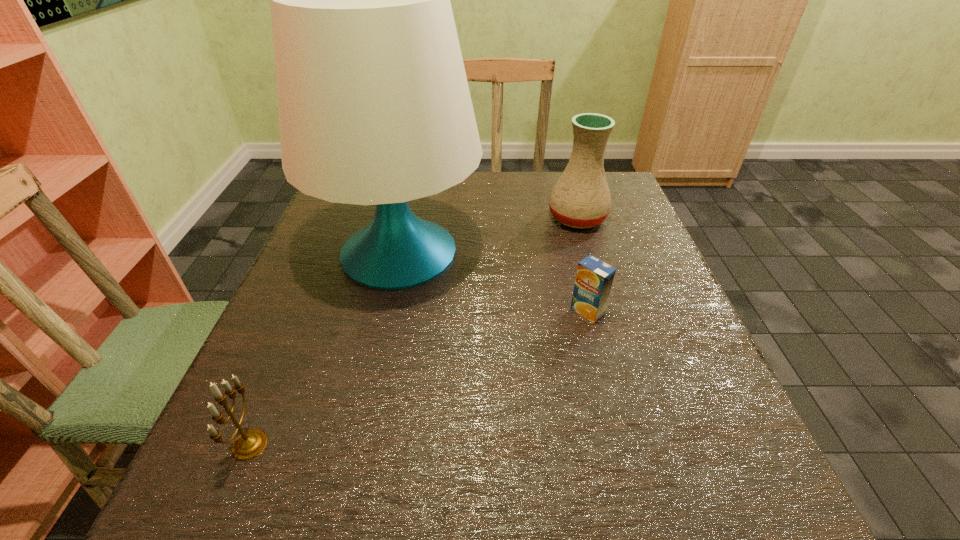
In the image, there is a desktop. Where is `blank space at the near edge`? blank space at the near edge is located at coordinates (593, 468).

In the image, there is a desktop. Where is `free space at the left edge`? This screenshot has width=960, height=540. free space at the left edge is located at coordinates (249, 383).

Locate an element on the screen. The height and width of the screenshot is (540, 960). blank space at the right edge of the desktop is located at coordinates (653, 255).

At what (x,y) coordinates should I click in order to perform the action: click on free location at the far left corner of the desktop. Please return your answer as a coordinate pair (x, y). This screenshot has width=960, height=540. Looking at the image, I should click on (356, 208).

Where is `vacant space at the near left corner of the desktop`? vacant space at the near left corner of the desktop is located at coordinates click(x=300, y=494).

Where is `free space between the orange_juice and the tallest object`? This screenshot has height=540, width=960. free space between the orange_juice and the tallest object is located at coordinates (493, 281).

Locate an element on the screen. The width and height of the screenshot is (960, 540). vacant space that's between the tallest object and the pottery is located at coordinates (489, 234).

Identify the location of free space that is in between the orange_juice and the candelabrum. (419, 378).

At what (x,y) coordinates should I click in order to perform the action: click on free space between the tallest object and the pottery. Please return your answer as a coordinate pair (x, y). The height and width of the screenshot is (540, 960). Looking at the image, I should click on (489, 234).

The width and height of the screenshot is (960, 540). What are the coordinates of `unoccupied position between the second shortest object and the third shortest object` in the screenshot? It's located at pos(414,331).